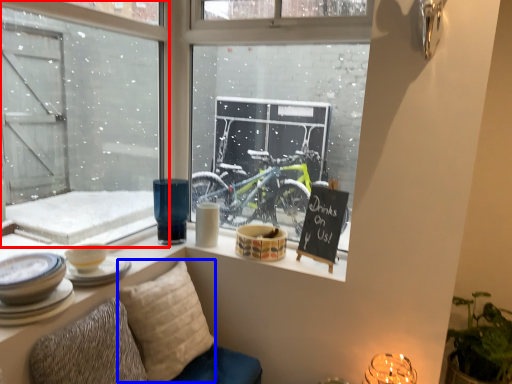
Question: Which object is closer to the camera taking this photo, window (highlighted by a red box) or pillow (highlighted by a blue box)?

Choices:
 (A) window
 (B) pillow

Answer: (A)